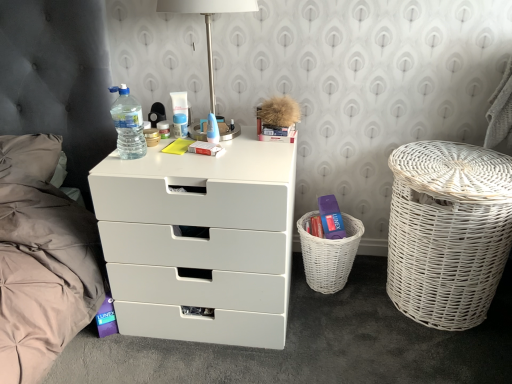
I want to click on vacant space in between white matte chest of drawers at center and white wicker basket at lower right, so click(x=314, y=314).